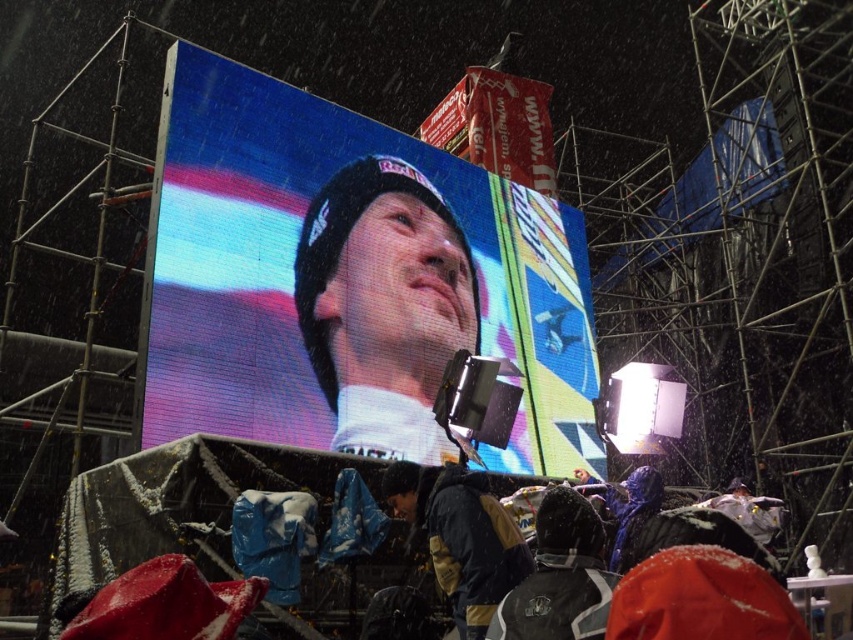
You are a photographer trying to capture the LED screen at center in the image. The screen is located at coordinates point [347,280]. If you are standing at the origin point 0,0, which direction should you move to get closer to the LED screen at center?

The point [347,280] is located to the right and above the origin point 0,0, so you should move to the right and upwards to get closer to the LED screen at center.

You are an event planner trying to place a new banner. The banner must be placed at the exact center of the image. Where should you position it relative to the led display at center?

The exact center of the image is at point coordinates of (426,320). The led display at center is located at point coordinates of (347,280). Therefore, to place the banner at the exact center, it should be positioned slightly to the right and above the led display at center.